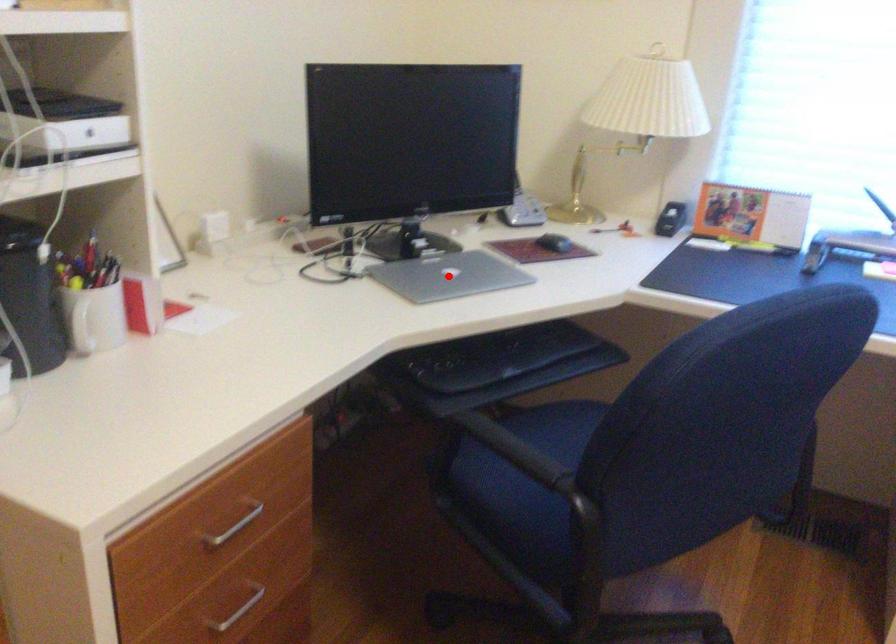
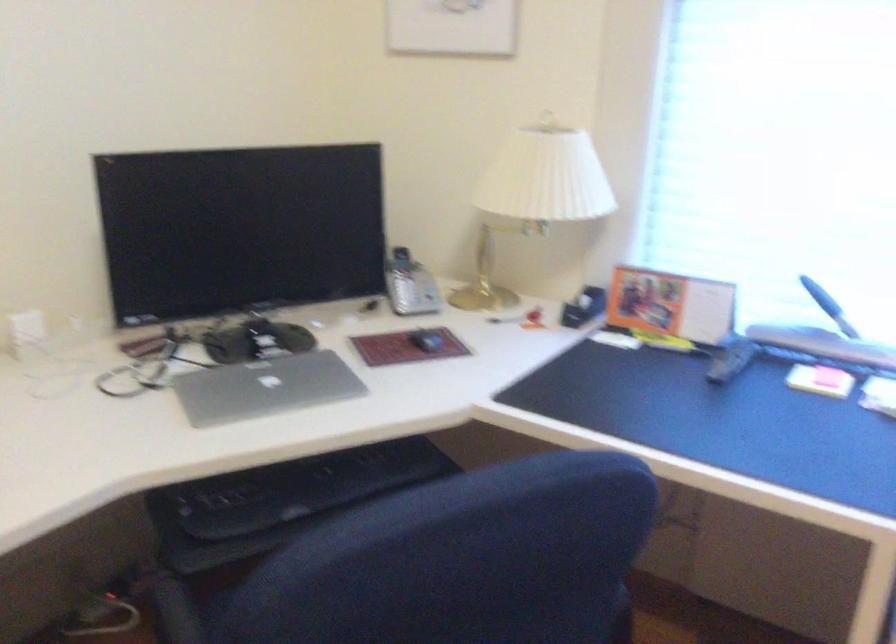
Question: I am providing you with two images of the same scene from different viewpoints. In image1, a red point is highlighted. Considering the same 3D point in image2, which of the following is correct?

Choices:
 (A) It is closer
 (B) It is farther

Answer: (A)